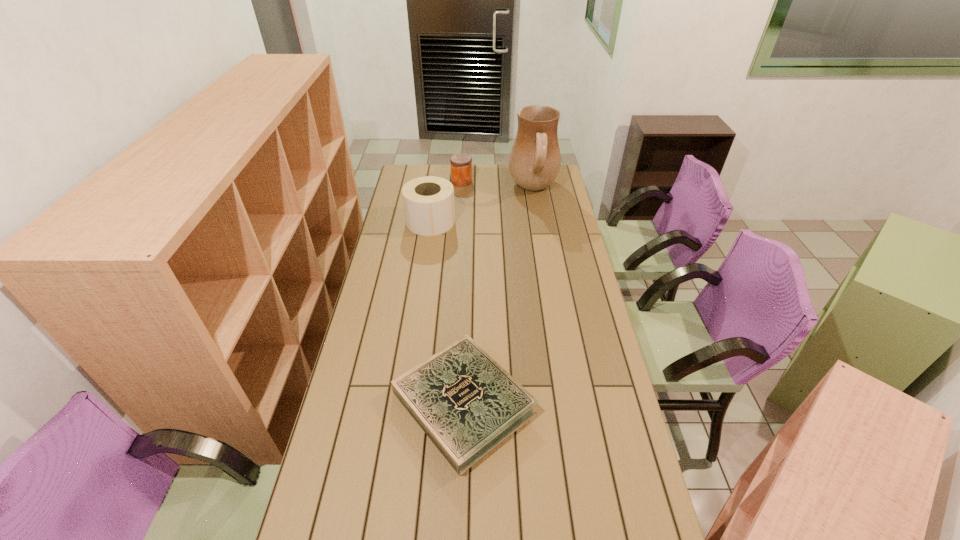
Where is `free spot that satisfies the following two spatial constraints: 1. at the spout of the tallest object; 2. on the front side of the second tallest object`? The width and height of the screenshot is (960, 540). free spot that satisfies the following two spatial constraints: 1. at the spout of the tallest object; 2. on the front side of the second tallest object is located at coordinates (540, 221).